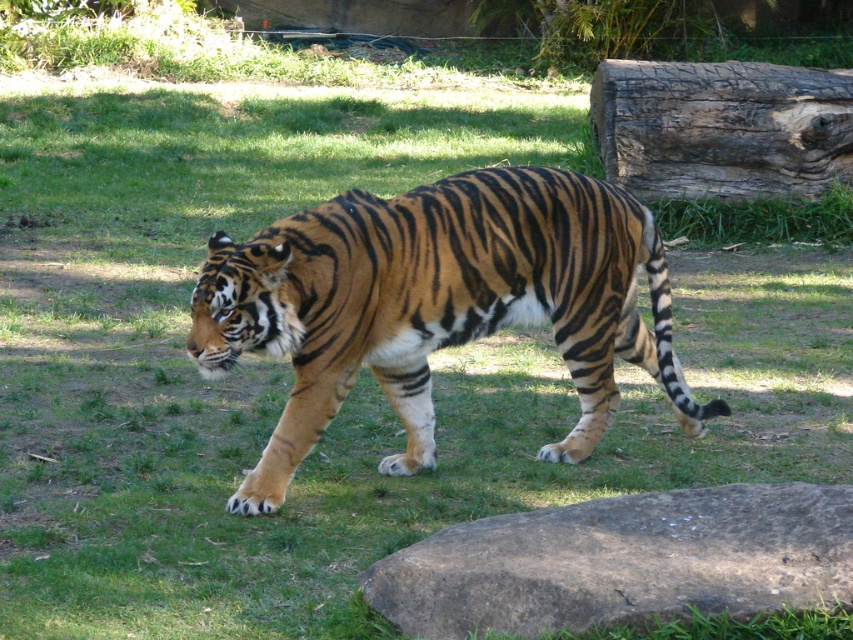
You are a zookeeper planning to place a new feeding station in the tiger enclosure. The station requires a solid, flat surface that can support heavy items. Considering the brown rough rock at lower right and the dark brown textured log at upper right, which object would be more suitable for this purpose?

The dark brown textured log at upper right is larger and likely more stable than the brown rough rock at lower right, making it a better choice for supporting heavy items.

Consider the image. You are standing at the origin point of the image coordinate system. You see two points, point (514, 200) and point (827, 579). Which point is closer to you?

Point (827, 579) is closer to you because it is in front of point (514, 200).